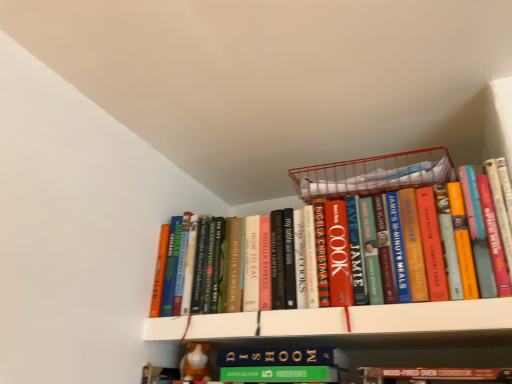
Question: Is white matte bookshelf at upper center at the left side of orange fabric dog at lower center?

Choices:
 (A) yes
 (B) no

Answer: (B)

Question: From the image's perspective, would you say white matte bookshelf at upper center is shown under orange fabric dog at lower center?

Choices:
 (A) yes
 (B) no

Answer: (B)

Question: Can you confirm if white matte bookshelf at upper center is bigger than orange fabric dog at lower center?

Choices:
 (A) yes
 (B) no

Answer: (A)

Question: Is white matte bookshelf at upper center at the right side of orange fabric dog at lower center?

Choices:
 (A) no
 (B) yes

Answer: (B)

Question: Can you confirm if white matte bookshelf at upper center is taller than orange fabric dog at lower center?

Choices:
 (A) no
 (B) yes

Answer: (A)

Question: From a real-world perspective, does white matte bookshelf at upper center sit lower than orange fabric dog at lower center?

Choices:
 (A) no
 (B) yes

Answer: (A)

Question: Is metallic wire basket at upper center completely or partially inside hardcover books at center?

Choices:
 (A) no
 (B) yes

Answer: (A)

Question: Can you confirm if hardcover books at center is thinner than metallic wire basket at upper center?

Choices:
 (A) no
 (B) yes

Answer: (B)

Question: Could you tell me if hardcover books at center is turned towards metallic wire basket at upper center?

Choices:
 (A) yes
 (B) no

Answer: (B)

Question: Are hardcover books at center and metallic wire basket at upper center beside each other?

Choices:
 (A) yes
 (B) no

Answer: (A)

Question: From a real-world perspective, is hardcover books at center located higher than metallic wire basket at upper center?

Choices:
 (A) yes
 (B) no

Answer: (B)

Question: Considering the relative sizes of hardcover books at center and metallic wire basket at upper center in the image provided, is hardcover books at center smaller than metallic wire basket at upper center?

Choices:
 (A) no
 (B) yes

Answer: (A)

Question: From the image's perspective, is metallic wire basket at upper center on hardcover books at center?

Choices:
 (A) no
 (B) yes

Answer: (B)